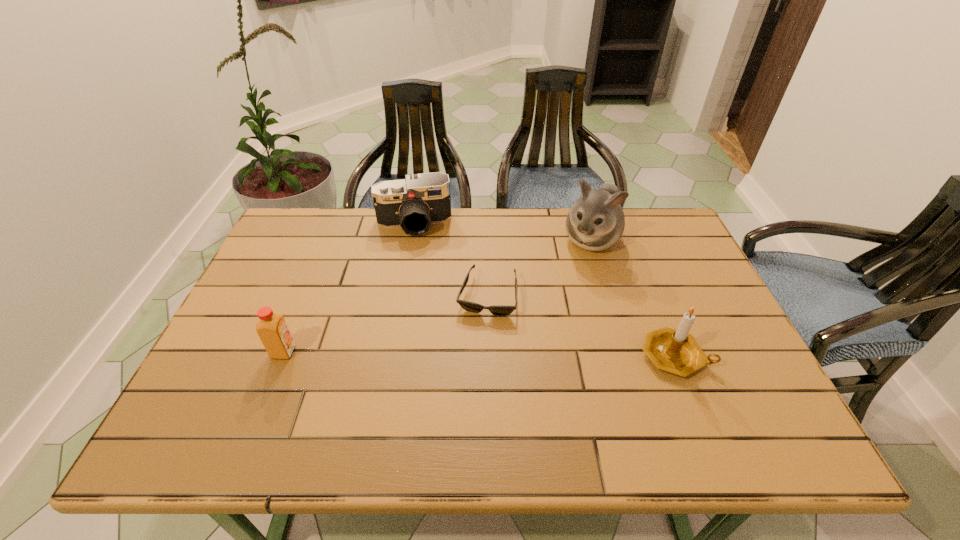
Find the location of a particular element. object that is positioned at the left edge is located at coordinates (272, 329).

You are a GUI agent. You are given a task and a screenshot of the screen. Output one action in this format:
    pyautogui.click(x=<x>, y=<y>)
    Task: Click on the object that is at the right edge
    
    Given the screenshot: What is the action you would take?
    pyautogui.click(x=675, y=351)

At what (x,y) coordinates should I click in order to perform the action: click on object present at the near right corner. Please return your answer as a coordinate pair (x, y). Looking at the image, I should click on (675, 351).

This screenshot has width=960, height=540. Identify the location of vacant space at the far edge of the desktop. click(490, 209).

Where is `vacant space at the near edge of the desktop`? vacant space at the near edge of the desktop is located at coordinates (577, 396).

The image size is (960, 540). I want to click on free space at the left edge, so click(228, 328).

Where is `free point at the right edge`? This screenshot has height=540, width=960. free point at the right edge is located at coordinates (688, 281).

In the image, there is a desktop. Identify the location of vacant space at the far left corner. (311, 251).

In order to click on vacant region between the candle holder and the tallest object in this screenshot , I will do `click(633, 298)`.

This screenshot has width=960, height=540. Identify the location of free spot between the candle holder and the third farthest object. (581, 326).